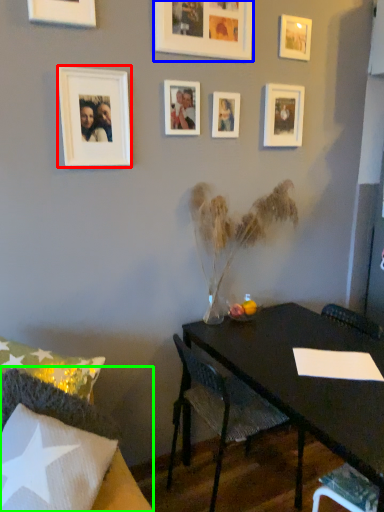
Question: Considering the real-world distances, which object is farthest from picture frame (highlighted by a red box)? picture frame (highlighted by a blue box) or chair (highlighted by a green box)?

Choices:
 (A) picture frame
 (B) chair

Answer: (B)